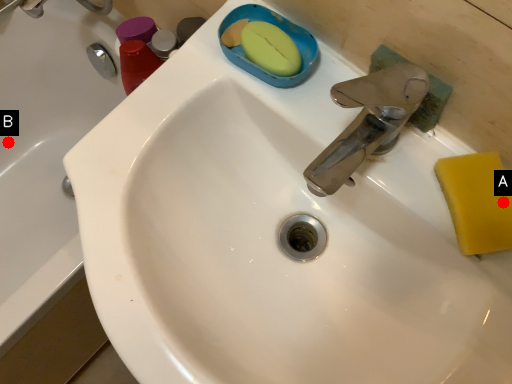
Question: Two points are circled on the image, labeled by A and B beside each circle. Which point is farther from the camera taking this photo?

Choices:
 (A) A is further
 (B) B is further

Answer: (B)